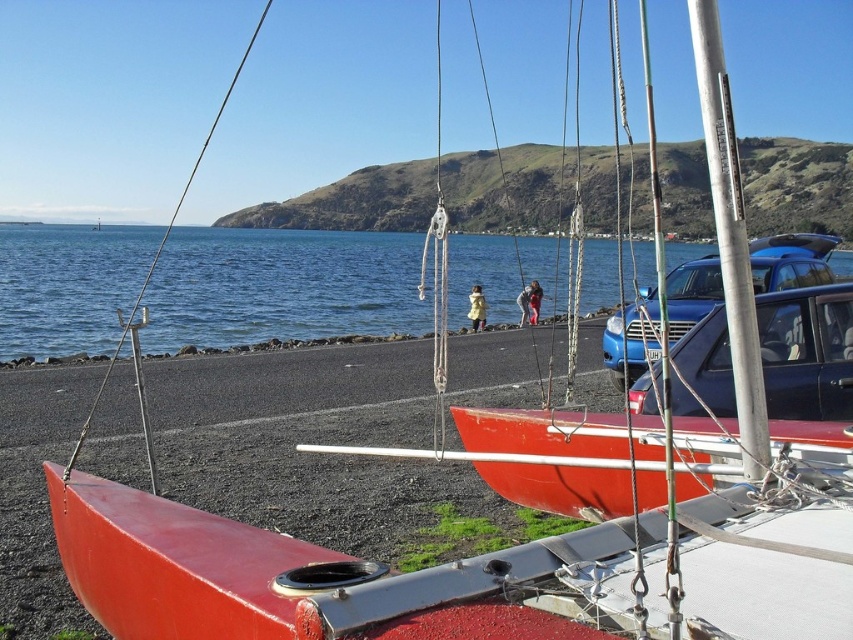
Between blue water at center and blue metallic car at center, which one appears on the left side from the viewer's perspective?

Positioned to the left is blue water at center.

How distant is blue water at center from blue metallic car at center?

The distance of blue water at center from blue metallic car at center is 39.66 meters.

Is point (165, 282) positioned behind point (643, 346)?

Yes, point (165, 282) is behind point (643, 346).

The image size is (853, 640). I want to click on blue water at center, so click(x=283, y=285).